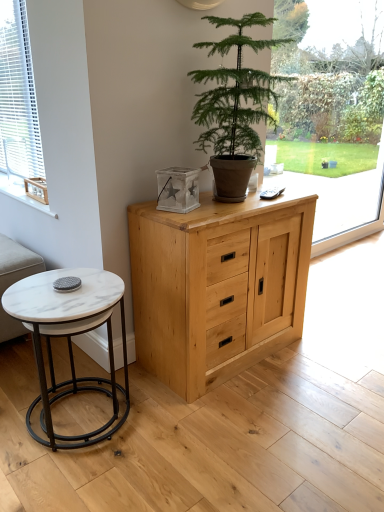
The width and height of the screenshot is (384, 512). Identify the location of vacant area that is in front of natural wood cabinet at center. (241, 434).